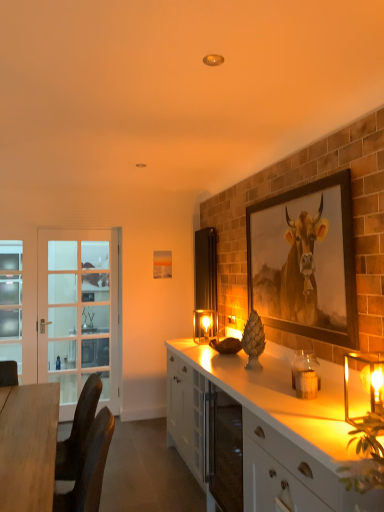
Question: Is translucent glass candle at right, the 2th candle holder in the back-to-front sequence, taller than light blue frosted glass screen door at left, which appears as the 2th screen door when viewed from the right?

Choices:
 (A) yes
 (B) no

Answer: (B)

Question: Is translucent glass candle at right, which is counted as the 2th candle holder, starting from the right, aimed at light blue frosted glass screen door at left, which appears as the 2th screen door when viewed from the right?

Choices:
 (A) yes
 (B) no

Answer: (B)

Question: From the image's perspective, does translucent glass candle at right, which is counted as the 2th candle holder, starting from the right, appear lower than light blue frosted glass screen door at left, which appears as the 2th screen door when viewed from the right?

Choices:
 (A) yes
 (B) no

Answer: (A)

Question: Are translucent glass candle at right, the 2th candle holder in the back-to-front sequence, and light blue frosted glass screen door at left, positioned as the first screen door in left-to-right order, beside each other?

Choices:
 (A) no
 (B) yes

Answer: (A)

Question: Is translucent glass candle at right, the 2th candle holder in the back-to-front sequence, facing away from light blue frosted glass screen door at left, which appears as the 2th screen door when viewed from the right?

Choices:
 (A) no
 (B) yes

Answer: (A)

Question: Would you say translucent glass candle at right, the 2th candle holder in the back-to-front sequence, contains light blue frosted glass screen door at left, positioned as the first screen door in left-to-right order?

Choices:
 (A) yes
 (B) no

Answer: (B)

Question: Considering the relative sizes of light blue frosted glass screen door at left, positioned as the first screen door in left-to-right order, and wooden desk at left in the image provided, is light blue frosted glass screen door at left, positioned as the first screen door in left-to-right order, bigger than wooden desk at left?

Choices:
 (A) no
 (B) yes

Answer: (A)

Question: Is light blue frosted glass screen door at left, which appears as the 2th screen door when viewed from the right, outside wooden desk at left?

Choices:
 (A) yes
 (B) no

Answer: (A)

Question: Can you confirm if light blue frosted glass screen door at left, which appears as the 2th screen door when viewed from the right, is thinner than wooden desk at left?

Choices:
 (A) yes
 (B) no

Answer: (A)

Question: Is light blue frosted glass screen door at left, positioned as the first screen door in left-to-right order, facing away from wooden desk at left?

Choices:
 (A) yes
 (B) no

Answer: (B)

Question: From the image's perspective, is light blue frosted glass screen door at left, positioned as the first screen door in left-to-right order, located above wooden desk at left?

Choices:
 (A) yes
 (B) no

Answer: (A)

Question: Can you confirm if light blue frosted glass screen door at left, positioned as the first screen door in left-to-right order, is positioned to the left of wooden desk at left?

Choices:
 (A) no
 (B) yes

Answer: (B)

Question: Does matte glass candle holder at center, the 1th candle holder when ordered from back to front, have a smaller size compared to white glossy cabinet at center, the 2th cabinetry from the front?

Choices:
 (A) yes
 (B) no

Answer: (A)